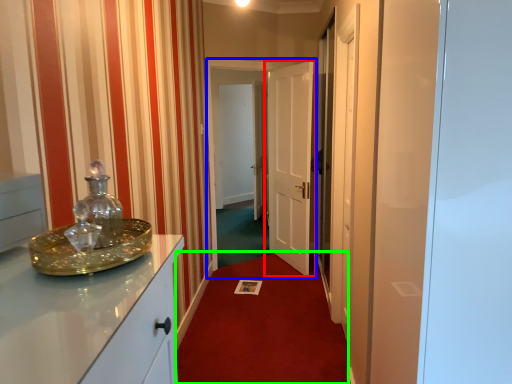
Question: Which object is the closest to the door (highlighted by a red box)? Choose among these: glass door (highlighted by a blue box) or plain (highlighted by a green box).

Choices:
 (A) glass door
 (B) plain

Answer: (A)